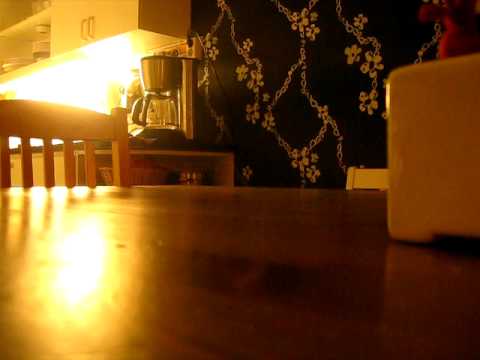
The width and height of the screenshot is (480, 360). Find the location of `porcelain`. porcelain is located at coordinates (440, 119).